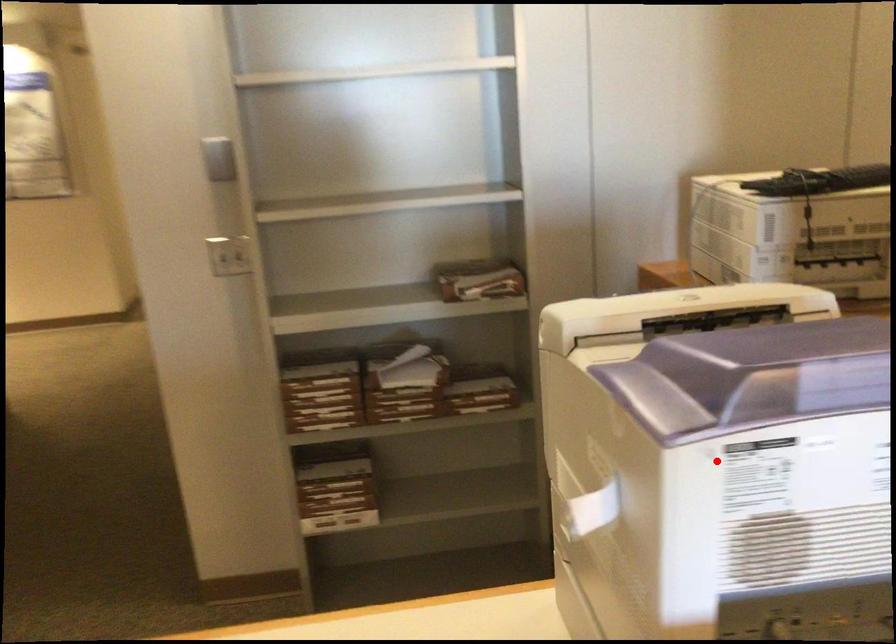
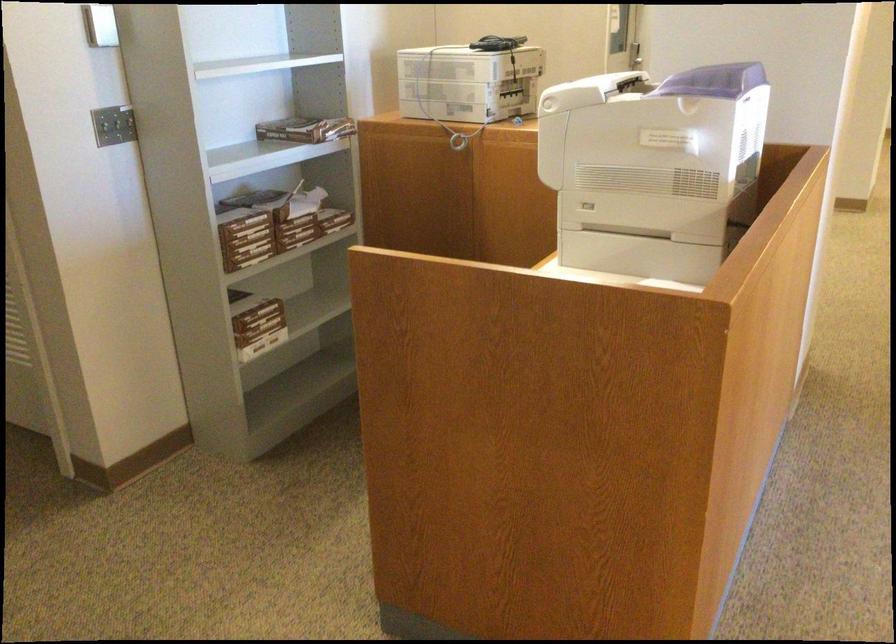
Question: I am providing you with two images of the same scene from different viewpoints. A red point is shown in image1. For the corresponding object point in image2, is it positioned nearer or farther from the camera?

Choices:
 (A) Nearer
 (B) Farther

Answer: (B)